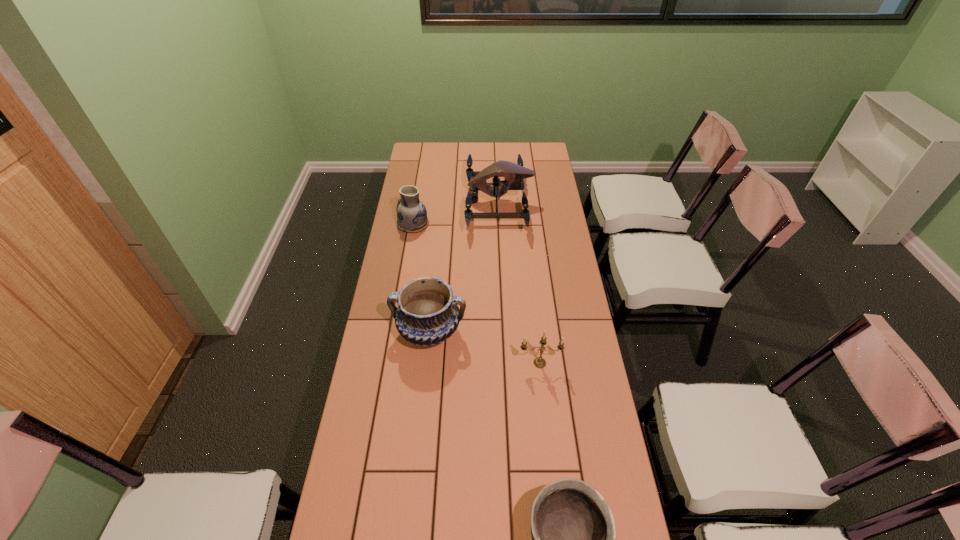
Identify the location of drone. The image size is (960, 540). click(514, 174).

I want to click on the second nearest pottery, so click(427, 314).

Locate an element on the screen. the farthest pottery is located at coordinates (411, 212).

This screenshot has height=540, width=960. Identify the location of candle. (539, 362).

I want to click on blank space located on the front-facing side of the drone, so click(x=436, y=202).

Locate an element on the screen. vacant space positioned 0.080m on the front-facing side of the drone is located at coordinates (448, 202).

Where is `vacant space located on the front-facing side of the drone`? Image resolution: width=960 pixels, height=540 pixels. vacant space located on the front-facing side of the drone is located at coordinates pos(441,202).

Locate an element on the screen. vacant space situated 0.090m on the back of the second nearest pottery is located at coordinates tap(434, 289).

Where is `free point located on the front of the farthest pottery`? free point located on the front of the farthest pottery is located at coordinates (404, 278).

Where is `vacant point located on the left of the candle`? This screenshot has height=540, width=960. vacant point located on the left of the candle is located at coordinates tap(430, 363).